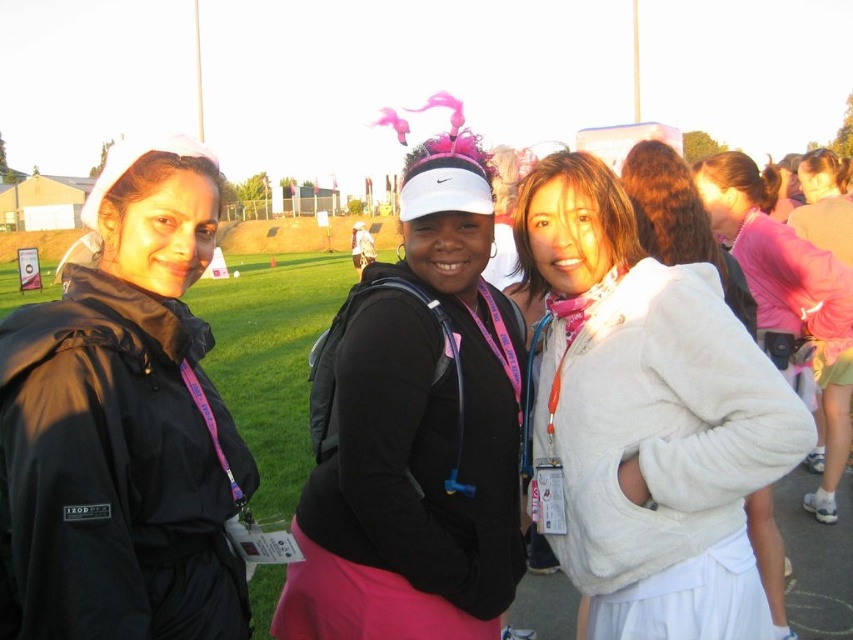
You are standing at the center of the field and want to walk towards the black matte jacket at left. In which direction should you head?

You should head to the left since the black matte jacket at left is located at point (122, 424) which is to the left side of the image.

You are a photographer trying to capture a closeup shot of the pink matte visor at center and the white fuzzy jacket at center. Given that your camera can only focus on objects within 25 inches of each other, will you be able to get both in focus?

The pink matte visor at center and white fuzzy jacket at center are 27.69 inches apart from each other, which exceeds the camera focus range of 25 inches. Therefore, you cannot get both in focus at the same time.